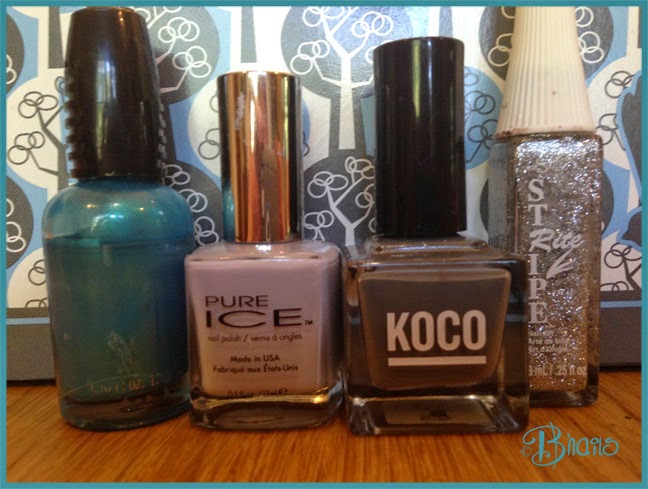
What are the coordinates of `turquoise paint` in the screenshot? It's located at (95, 307).